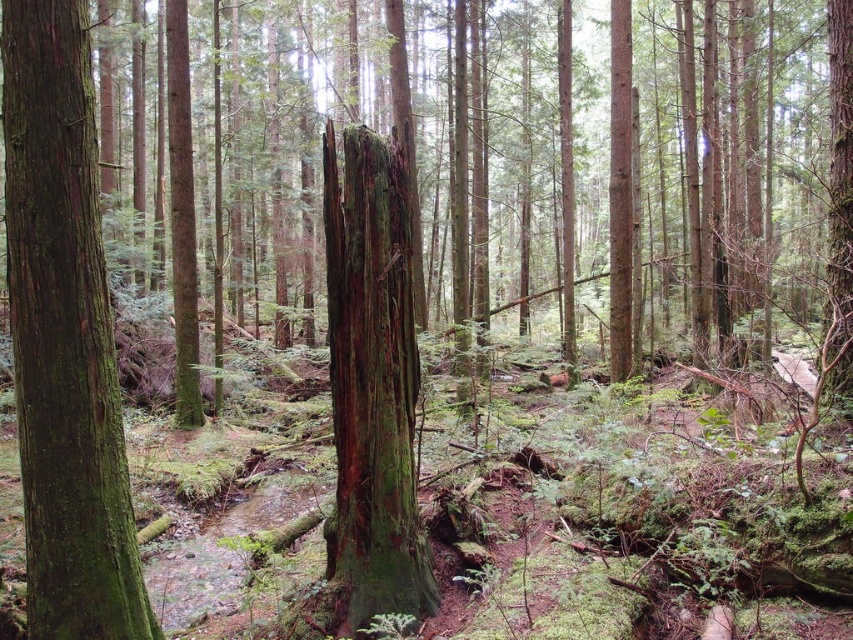
Is green rough bark tree trunk at left closer to camera compared to green mossy tree trunk at center?

Yes, green rough bark tree trunk at left is in front of green mossy tree trunk at center.

You are a GUI agent. You are given a task and a screenshot of the screen. Output one action in this format:
    pyautogui.click(x=<x>, y=<y>)
    Task: Click on the green rough bark tree trunk at left
    This screenshot has height=640, width=853.
    Given the screenshot: What is the action you would take?
    pyautogui.click(x=64, y=337)

You are a GUI agent. You are given a task and a screenshot of the screen. Output one action in this format:
    pyautogui.click(x=<x>, y=<y>)
    Task: Click on the green rough bark tree trunk at left
    This screenshot has height=640, width=853.
    Given the screenshot: What is the action you would take?
    pyautogui.click(x=64, y=337)